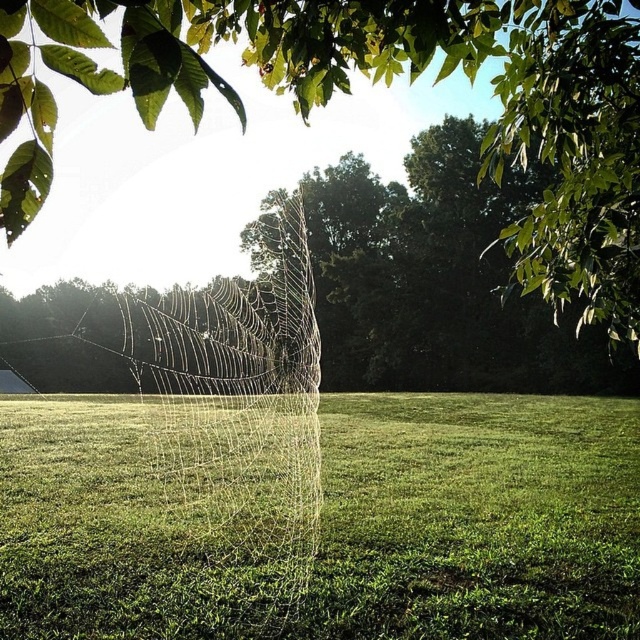
You are standing in the field looking at the spider web. There are two points marked on the web. The first point is at coordinates point (504, 488) and the second point is at point (177, 305). Which point is closer to you?

Point (504, 488) is in front of point (177, 305), so the first point is closer to you.

You are a small insect trying to land on the transparent silk web at center. From your perspective, where would you find the green grass at center in relation to the web?

The green grass at center is located below the transparent silk web at center, so from the insect perspective, the green grass at center would be underneath the web.

You are a tiny insect flying towards the transparent silk spider web at center and the transparent silk web at center. Which one is taller?

The transparent silk spider web at center is taller than the transparent silk web at center.